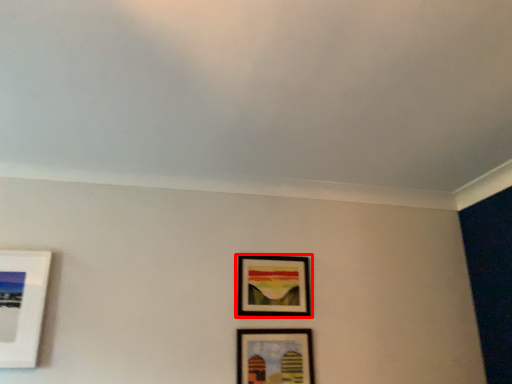
Question: From the image's perspective, what is the correct spatial positioning of picture frame (annotated by the red box) in reference to picture frame?

Choices:
 (A) below
 (B) above

Answer: (B)